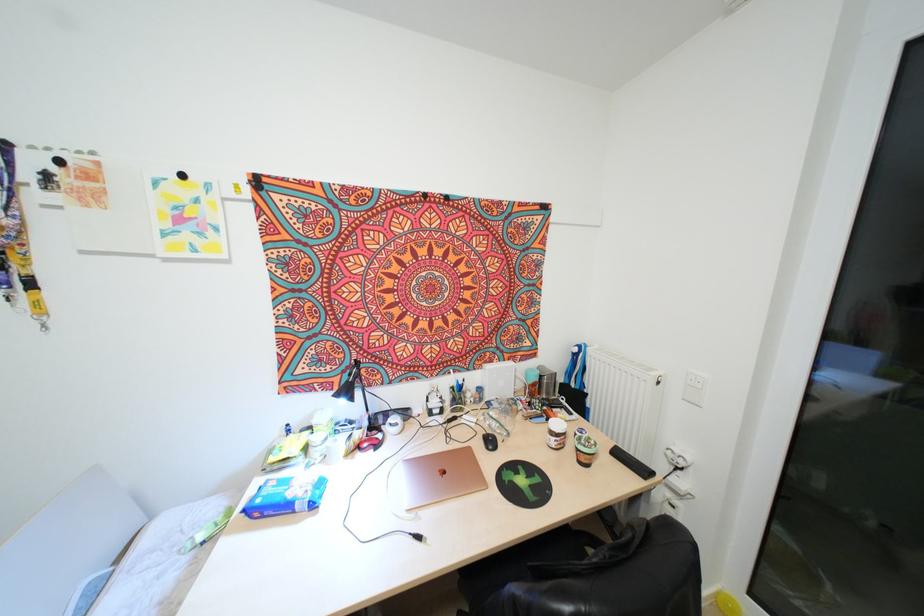
Identify the location of white light switch. This screenshot has width=924, height=616. (694, 387).